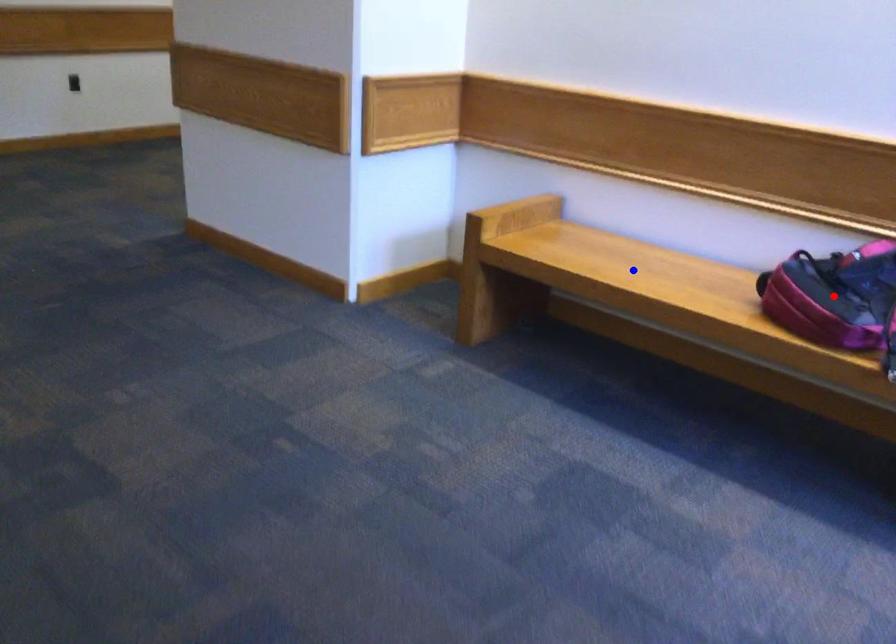
Question: Two points are marked on the image. Which point is closer to the camera?

Choices:
 (A) Blue point is closer.
 (B) Red point is closer.

Answer: (B)